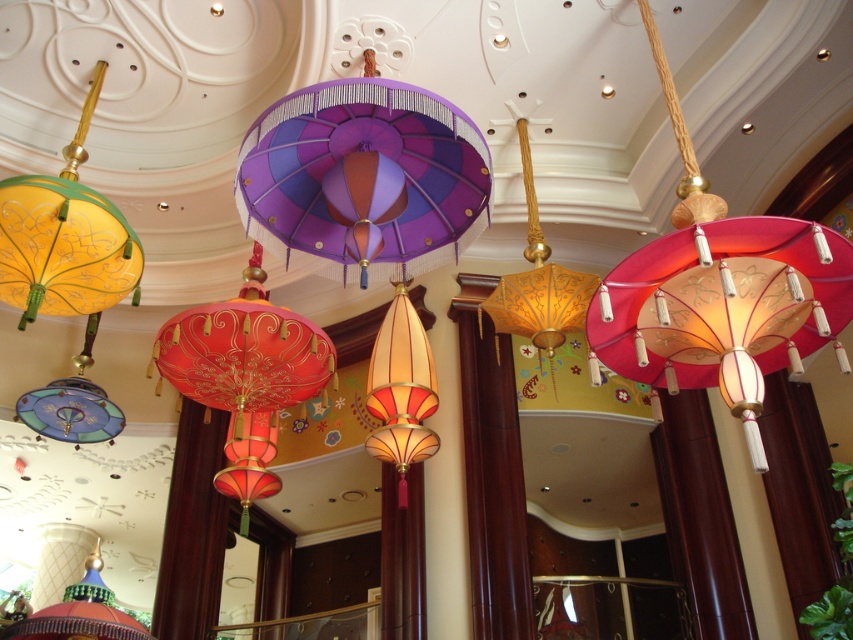
Is matte red paper lantern at right shorter than purple satin lantern at center?

No.

Where is `matte red paper lantern at right`? This screenshot has height=640, width=853. matte red paper lantern at right is located at coordinates (720, 292).

Find the location of a particular element. The width and height of the screenshot is (853, 640). matte red paper lantern at right is located at coordinates (720, 292).

Between matte red paper lantern at right and blue glass lantern at center, which one is positioned lower?

Positioned lower is blue glass lantern at center.

In the scene shown: Can you confirm if matte red paper lantern at right is thinner than blue glass lantern at center?

No, matte red paper lantern at right is not thinner than blue glass lantern at center.

The image size is (853, 640). Identify the location of matte red paper lantern at right. tap(720, 292).

The height and width of the screenshot is (640, 853). Find the location of `matte red paper lantern at right`. matte red paper lantern at right is located at coordinates (720, 292).

Is point (337, 193) positioned in front of point (564, 324)?

Yes, point (337, 193) is in front of point (564, 324).

Between purple satin lantern at center and gold paper lantern at center, which one appears on the left side from the viewer's perspective?

purple satin lantern at center is more to the left.

Does point (300, 176) come in front of point (527, 289)?

Yes.

Image resolution: width=853 pixels, height=640 pixels. I want to click on purple satin lantern at center, so click(364, 177).